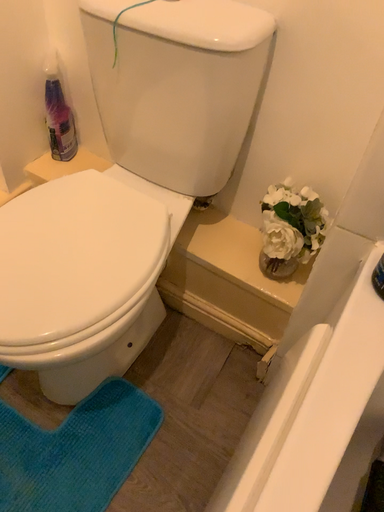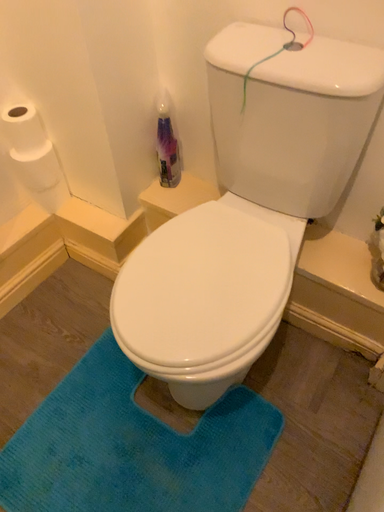
Question: Which way did the camera rotate in the video?

Choices:
 (A) rotated left
 (B) rotated right

Answer: (A)